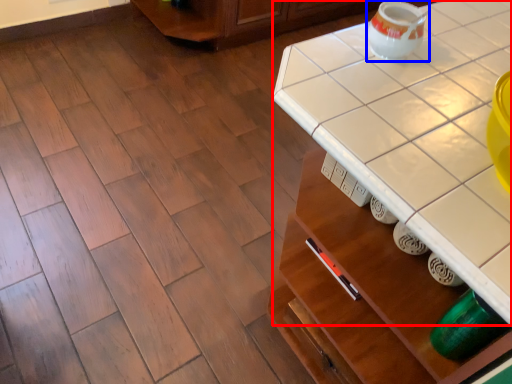
Question: Which object appears closest to the camera in this image, counter top (highlighted by a red box) or tea pot (highlighted by a blue box)?

Choices:
 (A) counter top
 (B) tea pot

Answer: (A)